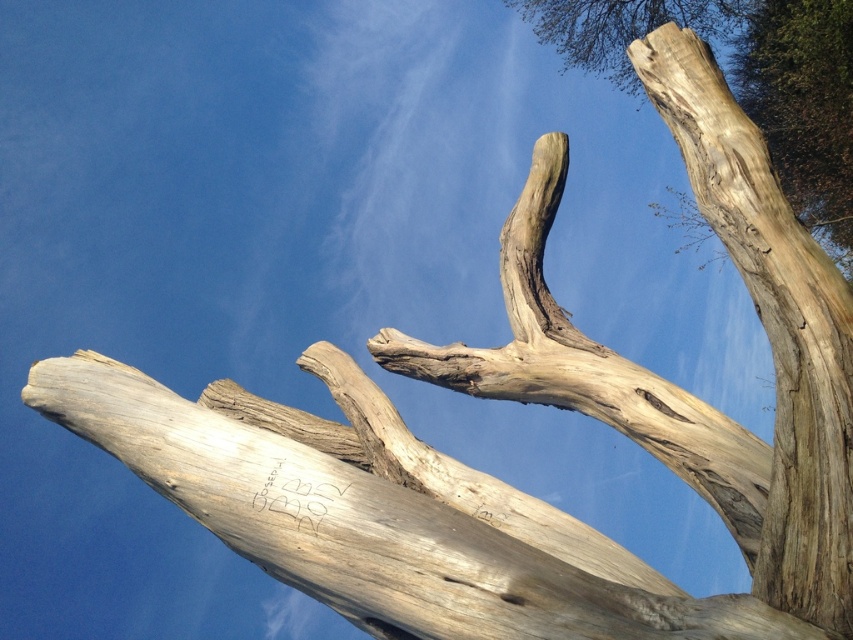
Question: Is light brown wood at upper right further to camera compared to natural wood tree trunk at upper right?

Choices:
 (A) no
 (B) yes

Answer: (A)

Question: Does light brown wood at upper right lie behind natural wood tree trunk at upper right?

Choices:
 (A) no
 (B) yes

Answer: (A)

Question: Which object is closer to the camera taking this photo?

Choices:
 (A) natural wood tree trunk at upper right
 (B) light brown wood at upper right

Answer: (B)

Question: Is the position of light brown wood at upper right more distant than that of natural wood tree trunk at upper right?

Choices:
 (A) yes
 (B) no

Answer: (B)

Question: Which of the following is the closest to the observer?

Choices:
 (A) light brown wood at upper right
 (B) natural wood tree trunk at upper right

Answer: (A)